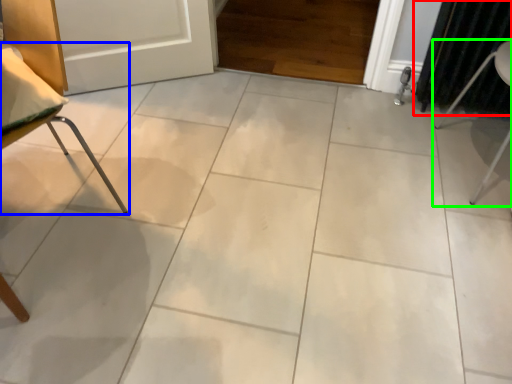
Question: Considering the real-world distances, which object is farthest from curtain (highlighted by a red box)? furniture (highlighted by a blue box) or furniture (highlighted by a green box)?

Choices:
 (A) furniture
 (B) furniture

Answer: (A)